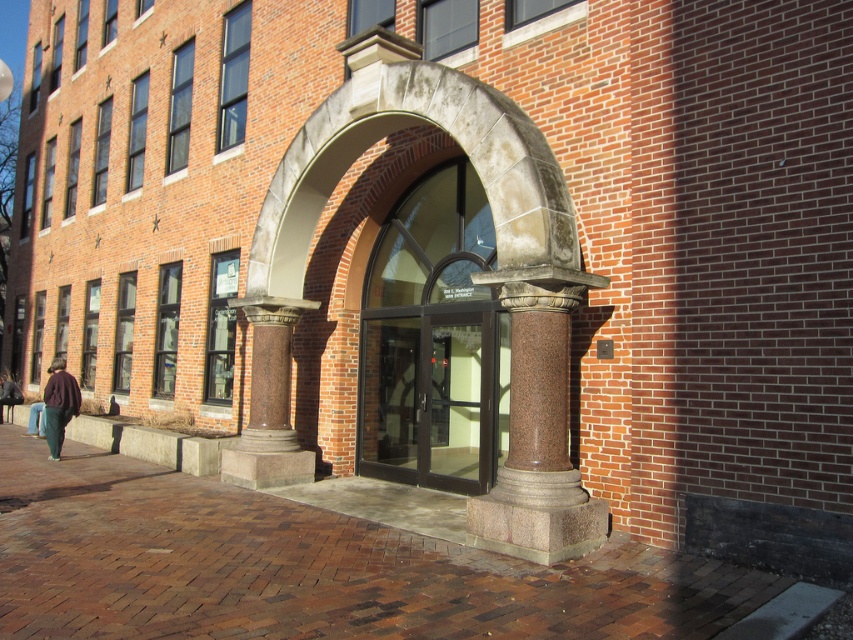
You are standing at the entrance of the brick building and want to hang a small hook on the wall behind the brown granite column at center. Is the dark brown leather jacket at lower left blocking the area where you want to place the hook?

The brown granite column at center is in front of the dark brown leather jacket at lower left, so the jacket is behind the column. Therefore, the dark brown leather jacket at lower left is not blocking the area behind the column where you want to place the hook.

You are a delivery person carrying a large package that is 8 meters wide. You arrive at the building and see the clear glass doors at center. Can you fit your package through the doors without tilting it?

The clear glass doors at center are 8.36 meters apart, so the package that is 8 meters wide can fit through the doors without tilting it since it is narrower than the door width.

You are a delivery person trying to park your 1.2 meter wide cart in the area shown in the image. The brick pavement at center and clear glass doors at center are in your path. Which area can accommodate your cart based on their sizes?

The brick pavement at center is bigger than clear glass doors at center, so the cart can be parked on the brick pavement at center since it has more space.